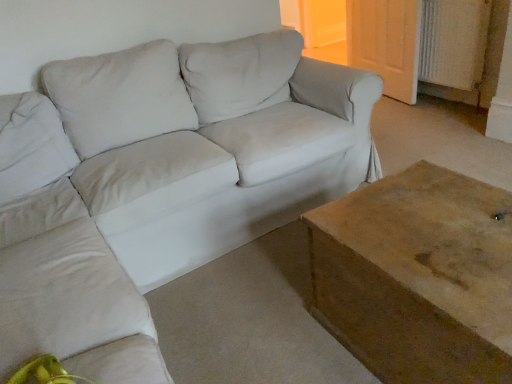
Question: From a real-world perspective, is wooden table at lower right positioned above or below white textured radiator at upper right?

Choices:
 (A) above
 (B) below

Answer: (B)

Question: Is wooden table at lower right wider or thinner than white textured radiator at upper right?

Choices:
 (A) thin
 (B) wide

Answer: (B)

Question: Estimate the real-world distances between objects in this image. Which object is farther from the light beige fabric couch at center?

Choices:
 (A) wooden door at upper right
 (B) white textured radiator at upper right
 (C) wooden table at lower right

Answer: (A)

Question: Considering the real-world distances, which object is closest to the light beige fabric couch at center?

Choices:
 (A) wooden table at lower right
 (B) wooden door at upper right
 (C) white textured radiator at upper right

Answer: (A)